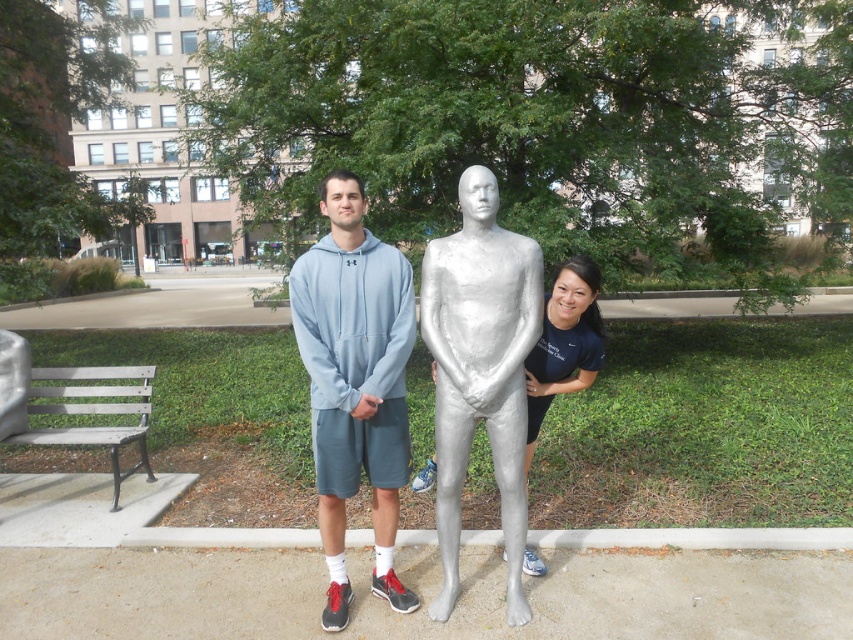
Which is in front, point (485, 417) or point (552, 316)?

Positioned in front is point (485, 417).

Is silver metallic mannequin at center smaller than metallic silver figure at center?

Incorrect, silver metallic mannequin at center is not smaller in size than metallic silver figure at center.

You are a GUI agent. You are given a task and a screenshot of the screen. Output one action in this format:
    pyautogui.click(x=<x>, y=<y>)
    Task: Click on the silver metallic mannequin at center
    
    Given the screenshot: What is the action you would take?
    pyautogui.click(x=480, y=371)

Is light blue hoodie at center wider than silver metallic statue at center?

Yes.

Does light blue hoodie at center appear over silver metallic statue at center?

Indeed, light blue hoodie at center is positioned over silver metallic statue at center.

The width and height of the screenshot is (853, 640). I want to click on light blue hoodie at center, so click(x=355, y=384).

You are a GUI agent. You are given a task and a screenshot of the screen. Output one action in this format:
    pyautogui.click(x=<x>, y=<y>)
    Task: Click on the light blue hoodie at center
    This screenshot has width=853, height=640.
    Given the screenshot: What is the action you would take?
    pyautogui.click(x=355, y=384)

In the scene shown: Can you confirm if light blue hoodie at center is positioned to the left of wooden slats bench at lower left?

Incorrect, light blue hoodie at center is not on the left side of wooden slats bench at lower left.

Is point (381, 470) positioned after point (78, 388)?

That is False.

Locate an element on the screen. This screenshot has height=640, width=853. light blue hoodie at center is located at coordinates (355, 384).